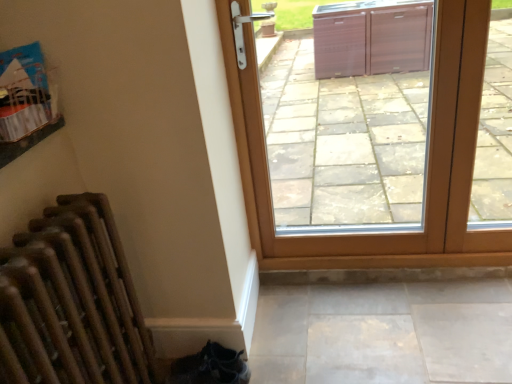
Question: Considering their positions, is brown wooden door at center located in front of or behind wooden radiator at lower left?

Choices:
 (A) behind
 (B) front

Answer: (A)

Question: From a real-world perspective, is brown wooden door at center physically located above or below wooden radiator at lower left?

Choices:
 (A) above
 (B) below

Answer: (A)

Question: Is brown wooden door at center inside or outside of wooden radiator at lower left?

Choices:
 (A) outside
 (B) inside

Answer: (A)

Question: In terms of height, does wooden radiator at lower left look taller or shorter compared to brown wooden door at center?

Choices:
 (A) short
 (B) tall

Answer: (A)

Question: Considering the positions of wooden radiator at lower left and brown wooden door at center in the image, is wooden radiator at lower left wider or thinner than brown wooden door at center?

Choices:
 (A) wide
 (B) thin

Answer: (A)

Question: From the image's perspective, is wooden radiator at lower left located above or below brown wooden door at center?

Choices:
 (A) above
 (B) below

Answer: (B)

Question: Would you say wooden radiator at lower left is to the left or to the right of brown wooden door at center in the picture?

Choices:
 (A) right
 (B) left

Answer: (B)